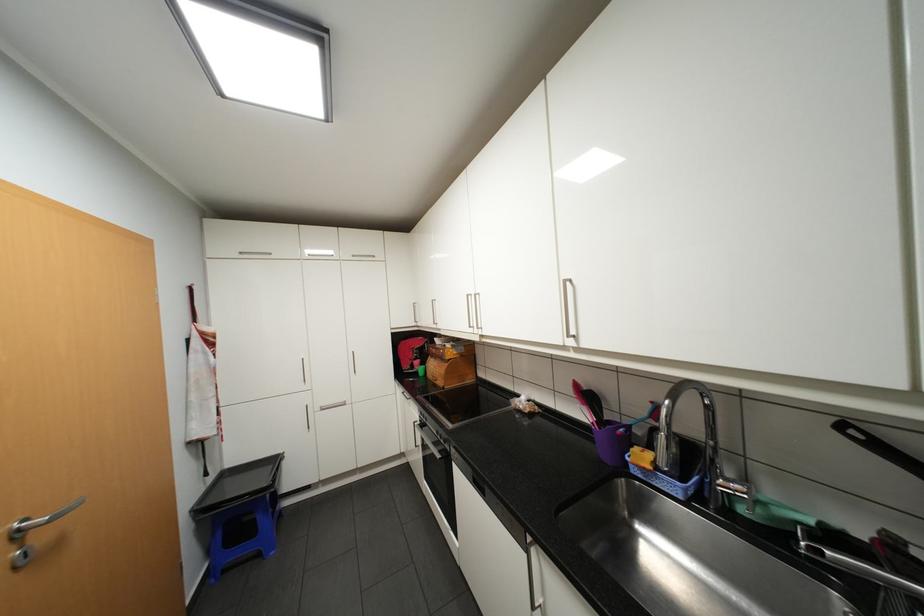
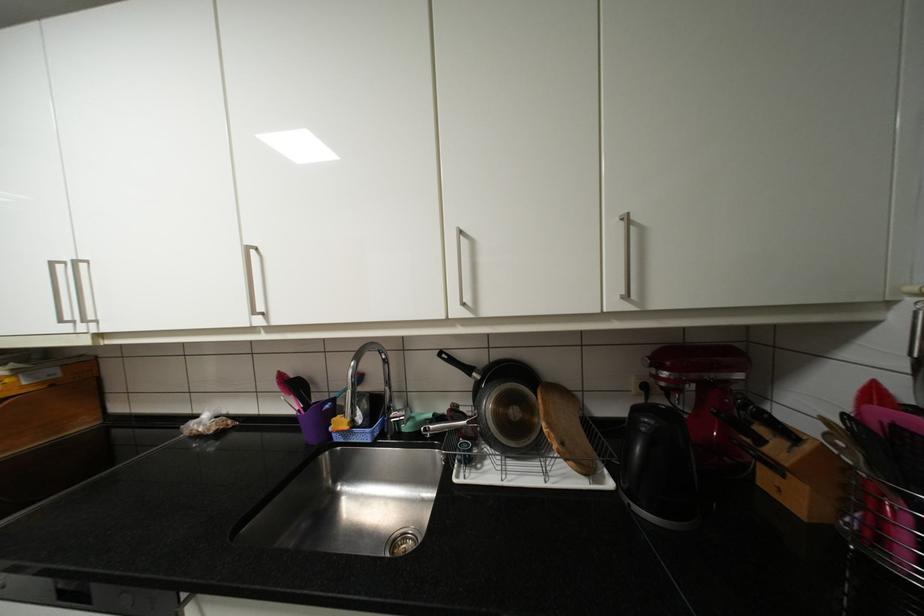
Question: The camera is either moving clockwise (left) or counter-clockwise (right) around the object. The first image is from the beginning of the video and the second image is from the end. Is the camera moving left or right when shooting the video?

Choices:
 (A) Left
 (B) Right

Answer: (A)